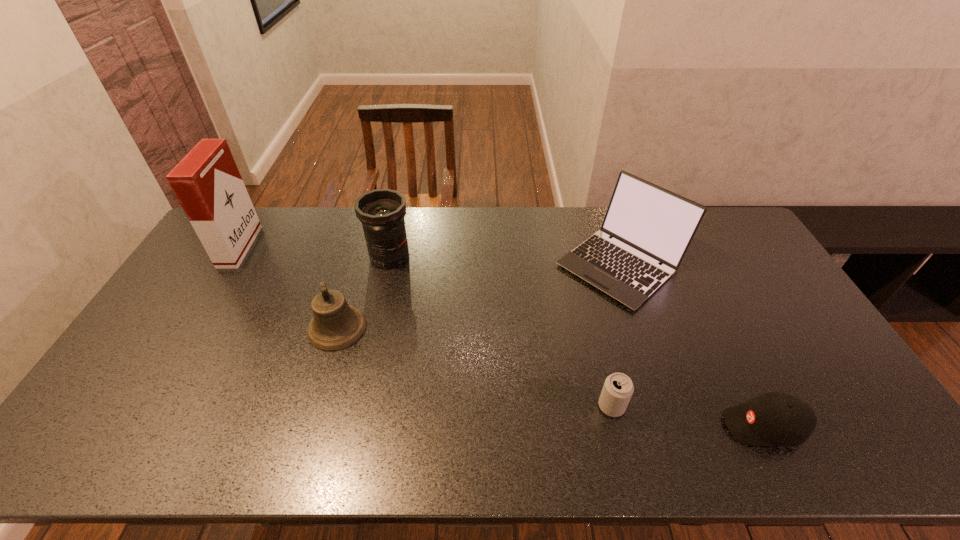
You are a GUI agent. You are given a task and a screenshot of the screen. Output one action in this format:
    pyautogui.click(x=<x>, y=<y>)
    Task: Click on the blank area in the image that satisfies the following two spatial constraints: 1. on the front-facing side of the telephoto lens; 2. on the right side of the tallest object
    Image resolution: width=960 pixels, height=540 pixels.
    Given the screenshot: What is the action you would take?
    pyautogui.click(x=234, y=256)

The height and width of the screenshot is (540, 960). What are the coordinates of `free location that satisfies the following two spatial constraints: 1. at the front screen of the laptop_computer; 2. on the front side of the bell` in the screenshot? It's located at (640, 328).